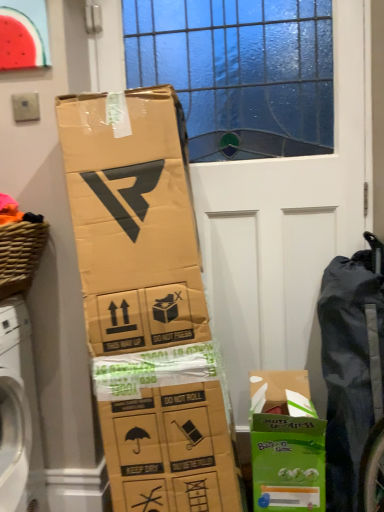
Question: In the image, is woven brown basket at left positioned in front of or behind green cardboard box at lower right?

Choices:
 (A) front
 (B) behind

Answer: (A)

Question: From a real-world perspective, is woven brown basket at left above or below green cardboard box at lower right?

Choices:
 (A) above
 (B) below

Answer: (A)

Question: Which object is the farthest from the watermelon matte plastic at upper left?

Choices:
 (A) black fabric bag at right
 (B) green cardboard box at lower right
 (C) woven brown basket at left

Answer: (B)

Question: Estimate the real-world distances between objects in this image. Which object is farther from the green cardboard box at lower right?

Choices:
 (A) woven brown basket at left
 (B) black fabric bag at right
 (C) watermelon matte plastic at upper left

Answer: (C)